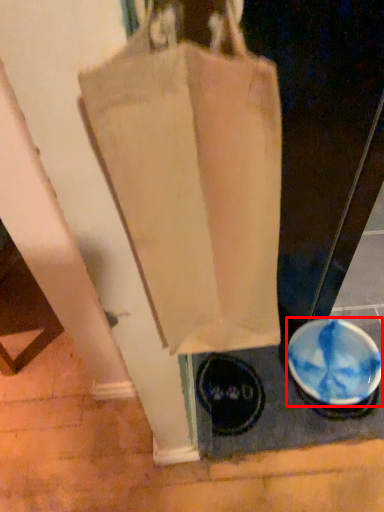
Question: From the image's perspective, what is the correct spatial positioning of bowl (annotated by the red box) in reference to handbag?

Choices:
 (A) above
 (B) below

Answer: (B)